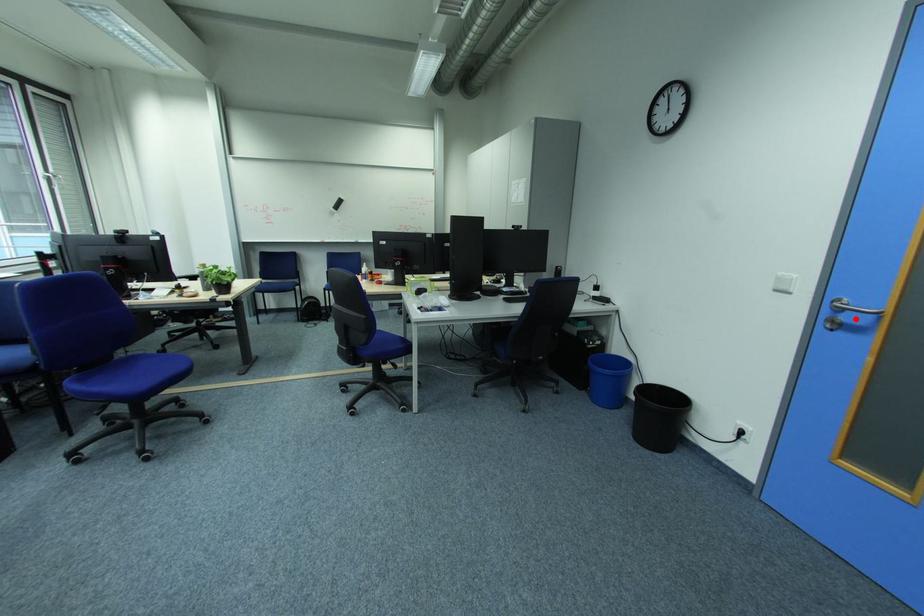
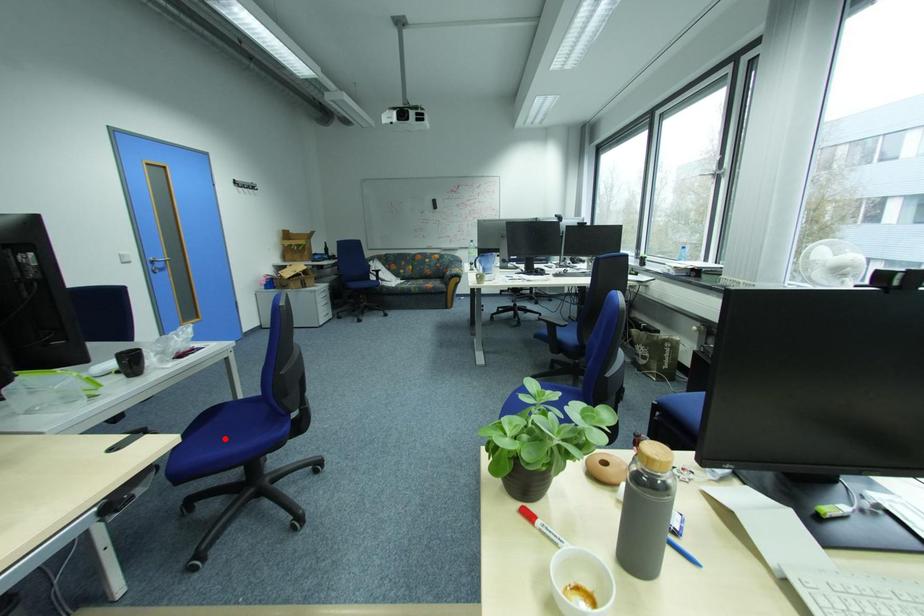
I am providing you with two images of the same scene from different viewpoints. A red point is marked on the first image and another point is marked on the second image. Is the red point in image1 aligned with the point shown in image2?

No